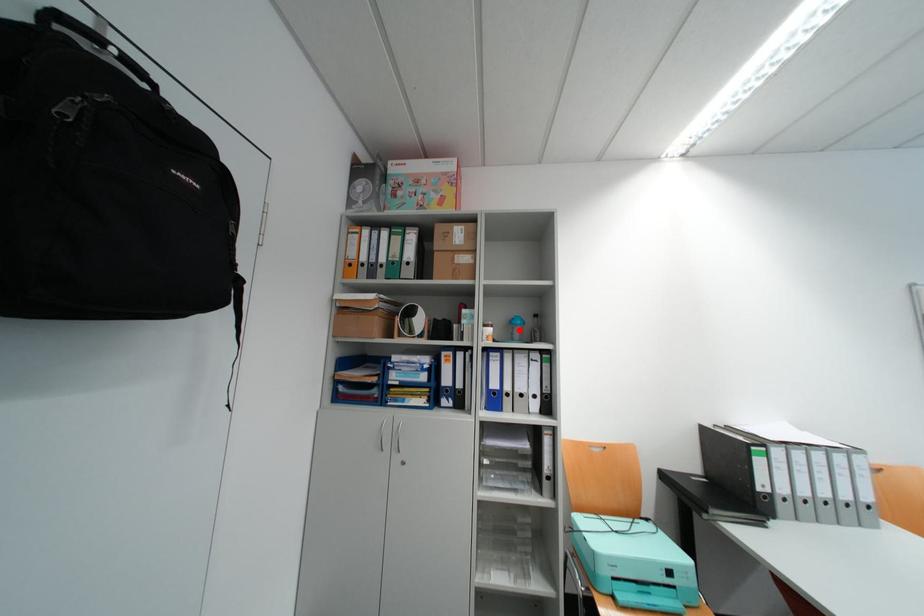
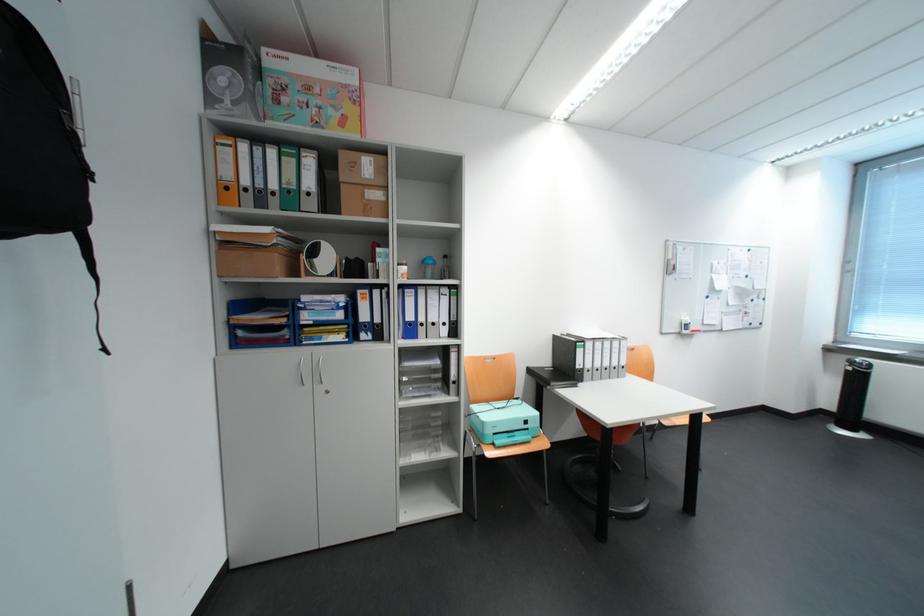
Where in the second image is the point corresponding to the highlighted location from the first image?

(432, 270)